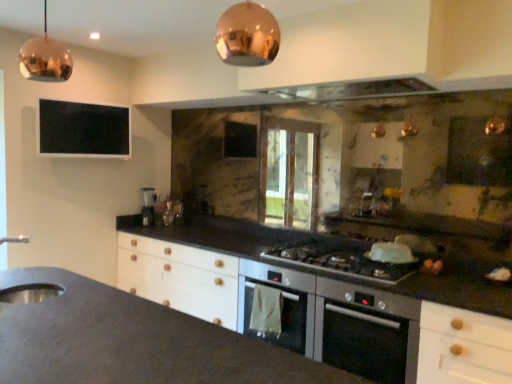
Find the location of `spots to the right of stainless steel sink at lower left`. spots to the right of stainless steel sink at lower left is located at coordinates (53, 292).